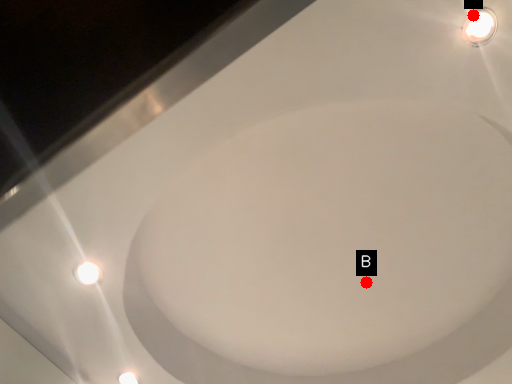
Question: Two points are circled on the image, labeled by A and B beside each circle. Which point is farther from the camera taking this photo?

Choices:
 (A) A is further
 (B) B is further

Answer: (B)